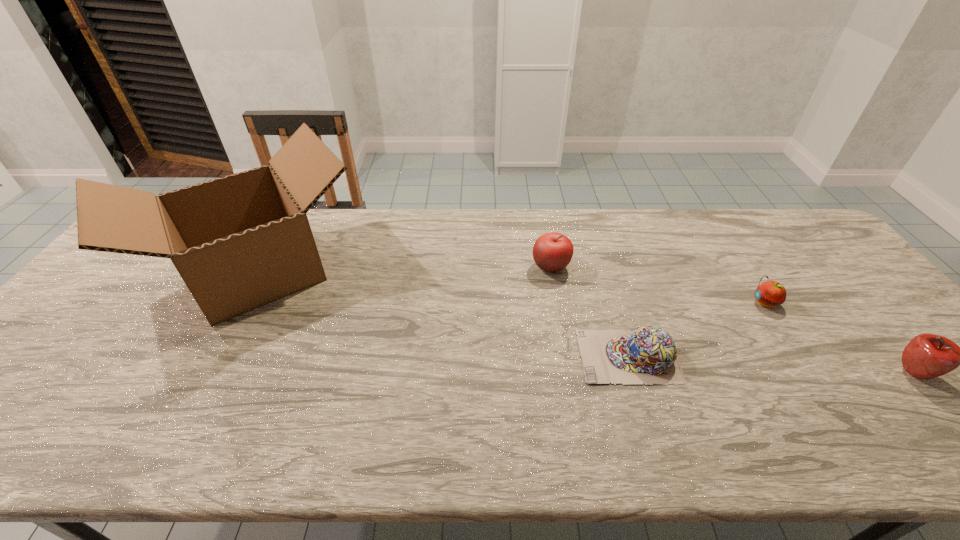
The width and height of the screenshot is (960, 540). Find the location of `the tallest object`. the tallest object is located at coordinates (239, 242).

The height and width of the screenshot is (540, 960). I want to click on the leftmost object, so click(239, 242).

The image size is (960, 540). I want to click on the leftmost apple, so click(552, 252).

Where is `the rightmost object`? the rightmost object is located at coordinates (926, 356).

Find the location of `the nearest apple`. the nearest apple is located at coordinates (926, 356).

Find the location of `the fourth object from left to right`. the fourth object from left to right is located at coordinates (769, 294).

This screenshot has height=540, width=960. Find the location of `the second apple from right to left`. the second apple from right to left is located at coordinates (769, 294).

At what (x,y) coordinates should I click in order to perform the action: click on cap. Please return your answer as a coordinate pair (x, y). Looking at the image, I should click on (648, 355).

Find the location of a particular element. The width and height of the screenshot is (960, 540). vacant space located 0.350m on the right of the box is located at coordinates (486, 271).

Find the location of a particular element. The image size is (960, 540). free space located 0.210m on the back of the leftmost apple is located at coordinates (541, 215).